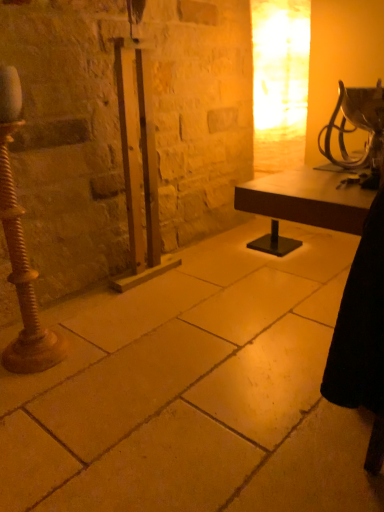
Question: From their relative heights in the image, would you say smooth stone floor at center is taller or shorter than rusty metal pole at left?

Choices:
 (A) tall
 (B) short

Answer: (B)

Question: Choose the correct answer: Is smooth stone floor at center inside rusty metal pole at left or outside it?

Choices:
 (A) inside
 (B) outside

Answer: (B)

Question: Estimate the real-world distances between objects in this image. Which object is closer to the rusty metal pole at left?

Choices:
 (A) smooth stone floor at center
 (B) metallic silver table lamp at upper right

Answer: (A)

Question: Estimate the real-world distances between objects in this image. Which object is closer to the rusty metal pole at left?

Choices:
 (A) metallic silver table lamp at upper right
 (B) smooth stone floor at center

Answer: (B)